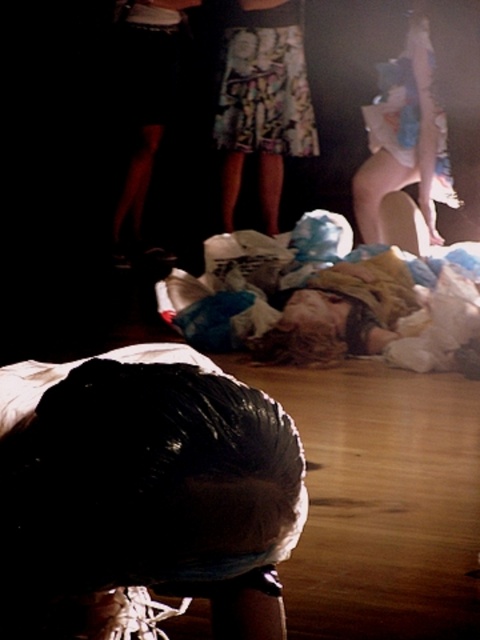
You are a photographer trying to capture the scene. You notice the black matte hair at lower center and the printed fabric skirt at center. Which object would appear narrower in your photo?

The black matte hair at lower center is thinner than the printed fabric skirt at center, so it would appear narrower in the photo.

In the scene shown: You are standing at point (240,54) and want to move to point (70,412). Is the path directly in front of you clear?

Yes, the path is clear because point (70,412) is in front of point (240,54), meaning there are no obstructions between them.

You are an observer in the scene. You see the black matte hair at lower center and the printed fabric skirt at center. Which object is positioned to the left?

The black matte hair at lower center is positioned to the left of the printed fabric skirt at center.